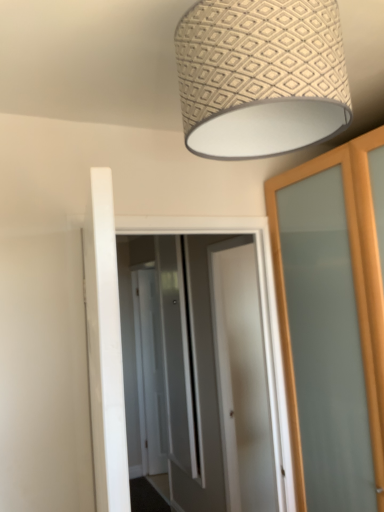
Find the location of a particular element. white glossy door at center is located at coordinates (242, 377).

This screenshot has height=512, width=384. Identify the location of white glossy door at center, arranged as the 1th screen door when viewed from the front. (200, 370).

Measure the distance between clear glass screen door at center, which is the 2th screen door from front to back, and camera.

A distance of 2.90 meters exists between clear glass screen door at center, which is the 2th screen door from front to back, and camera.

How much space does clear glass screen door at center, which is the 2th screen door from front to back, occupy horizontally?

It is 8.65 centimeters.

Describe the element at coordinates (261, 76) in the screenshot. I see `patterned fabric lampshade at upper center` at that location.

Where is `white glossy door at center`? white glossy door at center is located at coordinates (242, 377).

From the image's perspective, between white glossy door at center, acting as the first screen door starting from the back, and white glossy door at center, arranged as the 1th screen door when viewed from the front, who is located below?

white glossy door at center, acting as the first screen door starting from the back, appears lower in the image.

Looking at this image, is white glossy door at center, acting as the first screen door starting from the back, in contact with white glossy door at center, the 3th screen door when ordered from back to front?

No, white glossy door at center, acting as the first screen door starting from the back, is not making contact with white glossy door at center, the 3th screen door when ordered from back to front.

Choose the correct answer: Is white glossy door at center, acting as the first screen door starting from the back, inside white glossy door at center, arranged as the 1th screen door when viewed from the front, or outside it?

white glossy door at center, acting as the first screen door starting from the back, is not enclosed by white glossy door at center, arranged as the 1th screen door when viewed from the front.

Which is more to the left, white glossy door at center, acting as the first screen door starting from the back, or white glossy door at center, arranged as the 1th screen door when viewed from the front?

From the viewer's perspective, white glossy door at center, acting as the first screen door starting from the back, appears more on the left side.

From the image's perspective, is patterned fabric lampshade at upper center positioned above or below white glossy door at center, arranged as the 1th screen door when viewed from the front?

Based on their image positions, patterned fabric lampshade at upper center is located above white glossy door at center, arranged as the 1th screen door when viewed from the front.

Relative to white glossy door at center, arranged as the 1th screen door when viewed from the front, is patterned fabric lampshade at upper center in front or behind?

Visually, patterned fabric lampshade at upper center is located in front of white glossy door at center, arranged as the 1th screen door when viewed from the front.

At what (x,y) coordinates should I click in order to perform the action: click on lamp above the white glossy door at center, the 3th screen door when ordered from back to front (from the image's perspective). Please return your answer as a coordinate pair (x, y). This screenshot has height=512, width=384. Looking at the image, I should click on (261, 76).

Considering the relative sizes of patterned fabric lampshade at upper center and white glossy door at center, arranged as the 1th screen door when viewed from the front, in the image provided, is patterned fabric lampshade at upper center bigger than white glossy door at center, arranged as the 1th screen door when viewed from the front,?

Actually, patterned fabric lampshade at upper center might be smaller than white glossy door at center, arranged as the 1th screen door when viewed from the front.

Does white glossy door at center turn towards clear glass screen door at center, which is the 2th screen door from front to back?

No, white glossy door at center is not turned towards clear glass screen door at center, which is the 2th screen door from front to back.

From the image's perspective, who appears lower, white glossy door at center or clear glass screen door at center, the 2th screen door viewed from the back?

white glossy door at center appears lower in the image.

Identify the location of door that is below the clear glass screen door at center, which is the 2th screen door from front to back (from the image's perspective). (242, 377).

Is white glossy door at center to the right of clear glass screen door at center, which is the 2th screen door from front to back, from the viewer's perspective?

Yes, white glossy door at center is to the right of clear glass screen door at center, which is the 2th screen door from front to back.

Is white glossy door at center, arranged as the 1th screen door when viewed from the front, looking in the opposite direction of white glossy door at center?

No, white glossy door at center, arranged as the 1th screen door when viewed from the front, is not facing the opposite direction of white glossy door at center.

Between white glossy door at center, the 3th screen door when ordered from back to front, and white glossy door at center, which one appears on the right side from the viewer's perspective?

white glossy door at center.

Can we say white glossy door at center, arranged as the 1th screen door when viewed from the front, lies outside white glossy door at center?

That's correct, white glossy door at center, arranged as the 1th screen door when viewed from the front, is outside of white glossy door at center.

Is white glossy door at center, arranged as the 1th screen door when viewed from the front, positioned far away from white glossy door at center?

That's not correct — white glossy door at center, arranged as the 1th screen door when viewed from the front, is a little close to white glossy door at center.

Considering the sizes of objects white glossy door at center and patterned fabric lampshade at upper center in the image provided, who is smaller, white glossy door at center or patterned fabric lampshade at upper center?

patterned fabric lampshade at upper center.

Is white glossy door at center in front of patterned fabric lampshade at upper center?

No, white glossy door at center is behind patterned fabric lampshade at upper center.

Is white glossy door at center outside of patterned fabric lampshade at upper center?

white glossy door at center is positioned outside patterned fabric lampshade at upper center.

How distant is white glossy door at center from patterned fabric lampshade at upper center?

white glossy door at center and patterned fabric lampshade at upper center are 5.98 feet apart.

Which of these two, white glossy door at center, arranged as the 1th screen door when viewed from the front, or patterned fabric lampshade at upper center, stands shorter?

With less height is patterned fabric lampshade at upper center.

Is white glossy door at center, arranged as the 1th screen door when viewed from the front, positioned with its back to patterned fabric lampshade at upper center?

Yes, white glossy door at center, arranged as the 1th screen door when viewed from the front, is facing away from patterned fabric lampshade at upper center.

From a real-world perspective, which is physically above, white glossy door at center, arranged as the 1th screen door when viewed from the front, or patterned fabric lampshade at upper center?

In real-world perspective, patterned fabric lampshade at upper center is above.

Considering their positions, is white glossy door at center, the 3th screen door when ordered from back to front, located in front of or behind patterned fabric lampshade at upper center?

Clearly, white glossy door at center, the 3th screen door when ordered from back to front, is behind patterned fabric lampshade at upper center.

Is white glossy door at center oriented towards white glossy door at center, acting as the first screen door starting from the back?

No, white glossy door at center is not aimed at white glossy door at center, acting as the first screen door starting from the back.

Can you confirm if white glossy door at center is smaller than white glossy door at center, acting as the first screen door starting from the back?

Yes, white glossy door at center is smaller than white glossy door at center, acting as the first screen door starting from the back.

Is white glossy door at center at the left side of white glossy door at center, acting as the first screen door starting from the back?

In fact, white glossy door at center is to the right of white glossy door at center, acting as the first screen door starting from the back.

From the image's perspective, which screen door is the 2nd one below the white glossy door at center, the 3th screen door when ordered from back to front? Please provide its 2D coordinates.

[(150, 372)]

The width and height of the screenshot is (384, 512). I want to click on lamp that appears above the white glossy door at center, arranged as the 1th screen door when viewed from the front (from the image's perspective), so click(261, 76).

From the image, which object appears to be farther from clear glass screen door at center, which is the 2th screen door from front to back, white glossy door at center or patterned fabric lampshade at upper center?

patterned fabric lampshade at upper center is further to clear glass screen door at center, which is the 2th screen door from front to back.

Considering their positions, is white glossy door at center positioned further to white glossy door at center, acting as the first screen door starting from the back, than patterned fabric lampshade at upper center?

Based on the image, patterned fabric lampshade at upper center appears to be further to white glossy door at center, acting as the first screen door starting from the back.

When comparing their distances from white glossy door at center, arranged as the 1th screen door when viewed from the front, does white glossy door at center, which is counted as the 3th screen door, starting from the front, or white glossy door at center seem closer?

Based on the image, white glossy door at center appears to be nearer to white glossy door at center, arranged as the 1th screen door when viewed from the front.

Which object lies nearer to the anchor point white glossy door at center, arranged as the 1th screen door when viewed from the front, patterned fabric lampshade at upper center or clear glass screen door at center, the 2th screen door viewed from the back?

Among the two, clear glass screen door at center, the 2th screen door viewed from the back, is located nearer to white glossy door at center, arranged as the 1th screen door when viewed from the front.

In the scene shown: From the image, which object appears to be nearer to clear glass screen door at center, the 2th screen door viewed from the back, white glossy door at center, which is counted as the 3th screen door, starting from the front, or white glossy door at center?

white glossy door at center is closer to clear glass screen door at center, the 2th screen door viewed from the back.

Based on the photo, estimate the real-world distances between objects in this image. Which object is further from white glossy door at center, the 3th screen door when ordered from back to front, white glossy door at center, which is counted as the 3th screen door, starting from the front, or clear glass screen door at center, the 2th screen door viewed from the back?

The object further to white glossy door at center, the 3th screen door when ordered from back to front, is white glossy door at center, which is counted as the 3th screen door, starting from the front.

Looking at the image, which one is located closer to clear glass screen door at center, the 2th screen door viewed from the back, white glossy door at center, acting as the first screen door starting from the back, or patterned fabric lampshade at upper center?

white glossy door at center, acting as the first screen door starting from the back, is positioned closer to the anchor clear glass screen door at center, the 2th screen door viewed from the back.

From the image, which object appears to be farther from white glossy door at center, arranged as the 1th screen door when viewed from the front, clear glass screen door at center, the 2th screen door viewed from the back, or white glossy door at center, which is counted as the 3th screen door, starting from the front?

white glossy door at center, which is counted as the 3th screen door, starting from the front, is further to white glossy door at center, arranged as the 1th screen door when viewed from the front.

You are a GUI agent. You are given a task and a screenshot of the screen. Output one action in this format:
    pyautogui.click(x=<x>, y=<y>)
    Task: Click on the door between white glossy door at center, the 3th screen door when ordered from back to front, and clear glass screen door at center, which is the 2th screen door from front to back, in the front-back direction
    
    Given the screenshot: What is the action you would take?
    pyautogui.click(x=242, y=377)

You are a GUI agent. You are given a task and a screenshot of the screen. Output one action in this format:
    pyautogui.click(x=<x>, y=<y>)
    Task: Click on the door located between patterned fabric lampshade at upper center and clear glass screen door at center, the 2th screen door viewed from the back, in the depth direction
    The height and width of the screenshot is (512, 384).
    Given the screenshot: What is the action you would take?
    pyautogui.click(x=242, y=377)

Locate an element on the screen. screen door between patterned fabric lampshade at upper center and white glossy door at center in the front-back direction is located at coordinates (200, 370).

This screenshot has width=384, height=512. Identify the location of door positioned between patterned fabric lampshade at upper center and white glossy door at center, acting as the first screen door starting from the back, from near to far. (242, 377).